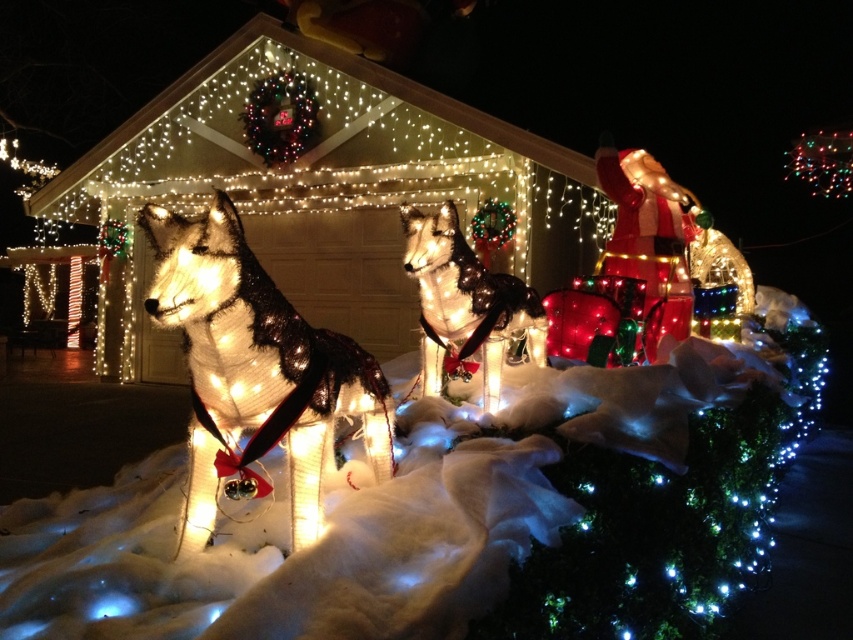
Question: Which object is positioned farthest from the illuminated mesh dog at center?

Choices:
 (A) illuminated plastic dog at center
 (B) icy white snow at lower left

Answer: (A)

Question: Can you confirm if icy white snow at lower left is positioned to the left of illuminated plastic dog at center?

Choices:
 (A) no
 (B) yes

Answer: (A)

Question: Which of the following is the farthest from the observer?

Choices:
 (A) (509, 328)
 (B) (653, 524)

Answer: (A)

Question: Which point appears farthest from the camera in this image?

Choices:
 (A) (808, 376)
 (B) (463, 262)
 (C) (189, 534)

Answer: (A)

Question: Is icy white snow at lower left above illuminated plastic dog at center?

Choices:
 (A) yes
 (B) no

Answer: (B)

Question: Does icy white snow at lower left appear on the right side of illuminated mesh dog at center?

Choices:
 (A) yes
 (B) no

Answer: (A)